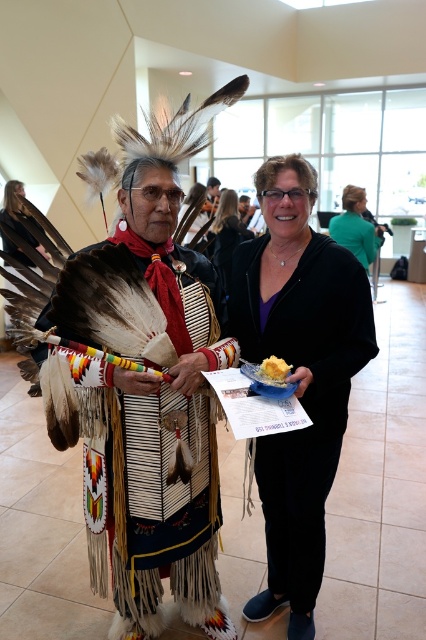
Question: Does white beaded and feathered vest at center have a smaller size compared to matte black plate at center?

Choices:
 (A) no
 (B) yes

Answer: (A)

Question: Can you confirm if matte black jacket at center is bigger than yellow fluffy bread at center?

Choices:
 (A) no
 (B) yes

Answer: (B)

Question: Is matte black plate at center closer to camera compared to green fabric jacket at center?

Choices:
 (A) no
 (B) yes

Answer: (B)

Question: Among these objects, which one is nearest to the camera?

Choices:
 (A) white beaded and feathered vest at center
 (B) matte black plate at center
 (C) green fabric jacket at center
 (D) yellow fluffy bread at center

Answer: (A)

Question: Which object is farther from the camera taking this photo?

Choices:
 (A) matte black plate at center
 (B) white beaded and feathered vest at center

Answer: (A)

Question: Which object appears closest to the camera in this image?

Choices:
 (A) green fabric jacket at center
 (B) matte black plate at center

Answer: (B)